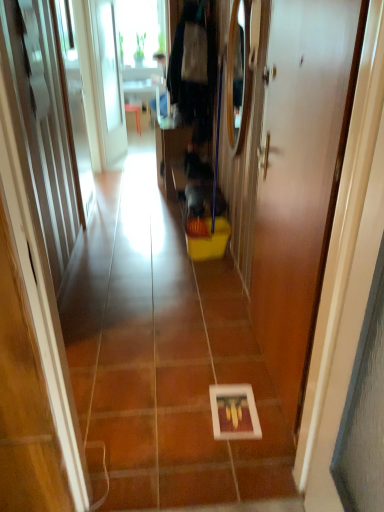
Locate an element on the screen. white glossy picture frame at center is located at coordinates (162, 359).

The image size is (384, 512). What do you see at coordinates (162, 359) in the screenshot?
I see `white glossy picture frame at center` at bounding box center [162, 359].

Measure the distance between white glossy picture frame at center and camera.

white glossy picture frame at center and camera are 1.55 meters apart from each other.

At what (x,y) coordinates should I click in order to perform the action: click on white glossy door at center. Please return your answer as a coordinate pair (x, y). Looking at the image, I should click on (301, 179).

The height and width of the screenshot is (512, 384). What do you see at coordinates (301, 179) in the screenshot?
I see `white glossy door at center` at bounding box center [301, 179].

Find the location of a particular element. Image resolution: width=384 pixels, height=512 pixels. white glossy picture frame at center is located at coordinates (162, 359).

Between white glossy door at center and white glossy picture frame at center, which one appears on the left side from the viewer's perspective?

Positioned to the left is white glossy picture frame at center.

Considering the positions of objects white glossy door at center and white glossy picture frame at center in the image provided, who is in front, white glossy door at center or white glossy picture frame at center?

white glossy door at center is in front.

Does point (322, 238) come behind point (90, 435)?

That is False.

From the image's perspective, which one is positioned higher, white glossy door at center or white glossy picture frame at center?

white glossy picture frame at center, from the image's perspective.

Based on the photo, from a real-world perspective, between white glossy door at center and white glossy picture frame at center, who is vertically lower?

white glossy picture frame at center.

Considering the relative sizes of white glossy door at center and white glossy picture frame at center in the image provided, is white glossy door at center thinner than white glossy picture frame at center?

Yes.

Considering the sizes of white glossy door at center and white glossy picture frame at center in the image, is white glossy door at center taller or shorter than white glossy picture frame at center?

In the image, white glossy door at center appears to be taller than white glossy picture frame at center.

Looking at the image, does white glossy door at center seem bigger or smaller compared to white glossy picture frame at center?

Clearly, white glossy door at center is smaller in size than white glossy picture frame at center.

Is white glossy door at center positioned beyond the bounds of white glossy picture frame at center?

Yes, white glossy door at center is not within white glossy picture frame at center.

In the scene shown: Are white glossy door at center and white glossy picture frame at center far apart?

No.

Could you tell me if white glossy door at center is facing white glossy picture frame at center?

No, white glossy door at center is not facing towards white glossy picture frame at center.

Consider the image. What's the angular difference between white glossy door at center and white glossy picture frame at center's facing directions?

The angle between the facing direction of white glossy door at center and the facing direction of white glossy picture frame at center is 89.2 degrees.

I want to click on path located above the white glossy door at center (from the image's perspective), so click(x=162, y=359).

Based on their positions, is white glossy picture frame at center located to the left or right of white glossy door at center?

white glossy picture frame at center is positioned on white glossy door at center's left side.

Is white glossy picture frame at center positioned in front of white glossy door at center?

No, white glossy picture frame at center is behind white glossy door at center.

From the picture: Which is closer to the camera, (x=172, y=212) or (x=309, y=352)?

The point (x=309, y=352) is more forward.

From the image's perspective, is white glossy picture frame at center on white glossy door at center?

Yes, from the image's perspective, white glossy picture frame at center is on top of white glossy door at center.

From a real-world perspective, is white glossy picture frame at center over white glossy door at center?

No.

Consider the image. Looking at their sizes, would you say white glossy picture frame at center is wider or thinner than white glossy door at center?

Clearly, white glossy picture frame at center has more width compared to white glossy door at center.

Is white glossy picture frame at center taller or shorter than white glossy door at center?

white glossy picture frame at center is shorter than white glossy door at center.

Which of these two, white glossy picture frame at center or white glossy door at center, is bigger?

With larger size is white glossy picture frame at center.

Consider the image. Do you think white glossy picture frame at center is within white glossy door at center, or outside of it?

The correct answer is: outside.

Is white glossy picture frame at center not near white glossy door at center?

They are positioned close to each other.

Is white glossy picture frame at center facing towards white glossy door at center?

No.

Find the location of a particular element. The width and height of the screenshot is (384, 512). path lying above the white glossy door at center (from the image's perspective) is located at coordinates (162, 359).

This screenshot has width=384, height=512. In order to click on path lying above the white glossy door at center (from the image's perspective) in this screenshot , I will do `click(162, 359)`.

Find the location of a particular element. path behind the white glossy door at center is located at coordinates (162, 359).